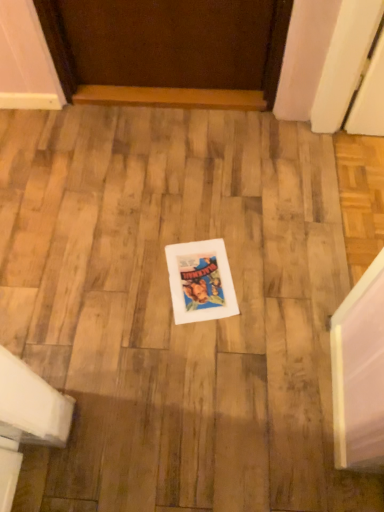
Where is `blank space situated above matte paper comic book at center (from a real-world perspective)`? The image size is (384, 512). blank space situated above matte paper comic book at center (from a real-world perspective) is located at coordinates (205, 276).